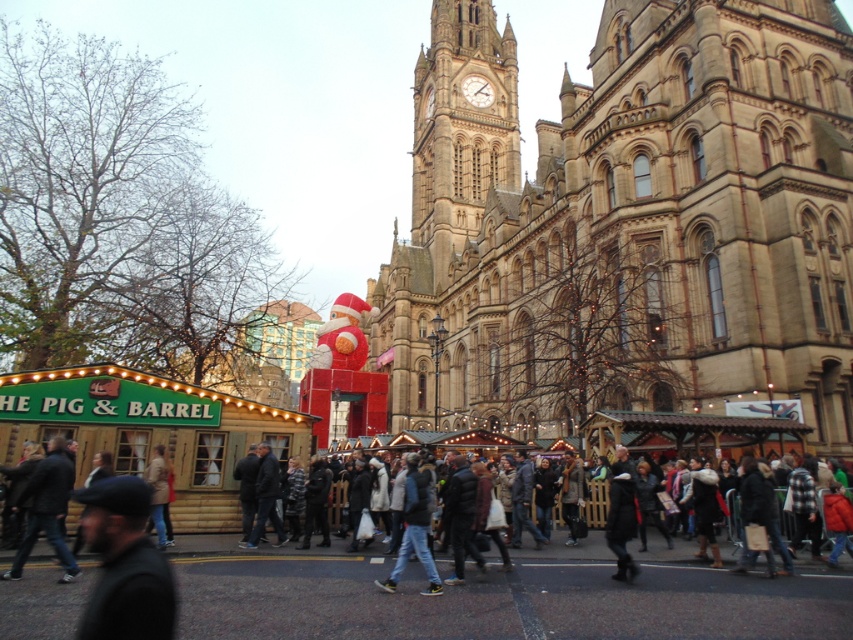
Who is lower down, dark gray jacket at lower left or light brown leather jacket at lower left?

light brown leather jacket at lower left is below.

Which is behind, point (22, 493) or point (160, 493)?

Positioned behind is point (160, 493).

Between point (67, 580) and point (148, 531), which one is positioned in front?

Point (67, 580)

The width and height of the screenshot is (853, 640). I want to click on dark gray jacket at lower left, so (47, 508).

Does dark gray clothing at center appear on the right side of jeans at center?

Correct, you'll find dark gray clothing at center to the right of jeans at center.

How far apart are dark gray clothing at center and jeans at center?

dark gray clothing at center is 23.48 feet from jeans at center.

The height and width of the screenshot is (640, 853). What are the coordinates of `dark gray clothing at center` in the screenshot? It's located at (611, 506).

You are a GUI agent. You are given a task and a screenshot of the screen. Output one action in this format:
    pyautogui.click(x=<x>, y=<y>)
    Task: Click on the dark gray clothing at center
    This screenshot has height=640, width=853.
    Given the screenshot: What is the action you would take?
    pyautogui.click(x=611, y=506)

From the picture: Who is more distant from viewer, (846, 120) or (405, 500)?

The point (846, 120) is behind.

Which of these two, beige stone cathedral at upper center or jeans at center, stands taller?

beige stone cathedral at upper center

Where is `beige stone cathedral at upper center`? The width and height of the screenshot is (853, 640). beige stone cathedral at upper center is located at coordinates (628, 224).

Where is `beige stone cathedral at upper center`? beige stone cathedral at upper center is located at coordinates (628, 224).